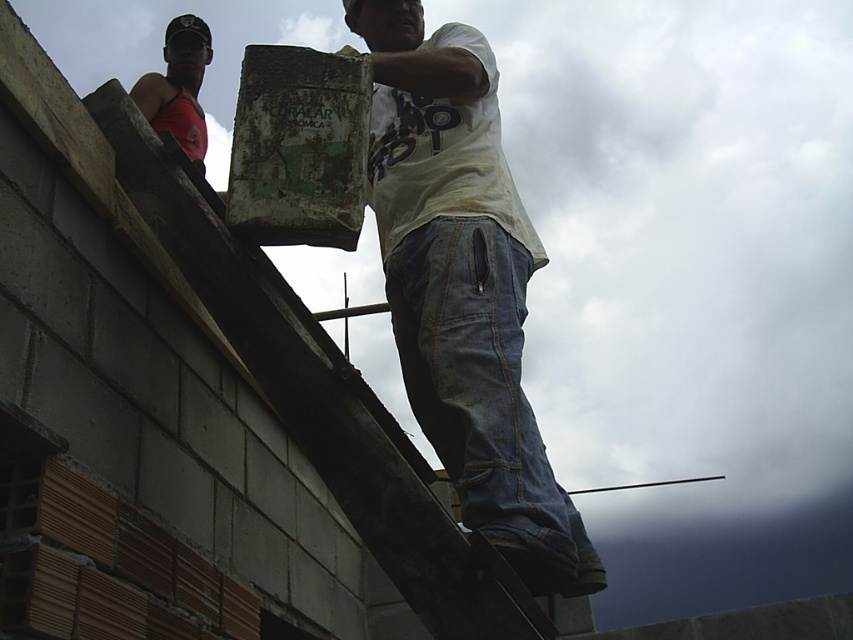
You are an observer looking at the construction site from below. You notice two workers wearing different shirts. The first is a white cotton shirt at center and the second is a matte red tank top at upper left. Which worker is standing higher relative to the other?

The white cotton shirt at center is taller than matte red tank top at upper left, so the worker wearing the white cotton shirt at center is standing higher than the one in the matte red tank top at upper left.

You are a safety inspector observing the construction site from the ground. You notice two workers wearing different colored shirts. The first is wearing a white cotton shirt at center, and the second is wearing a matte red tank top at upper left. According to safety protocols, workers must maintain a minimum distance of 2 meters between each other to prevent accidents. Can you determine if they are following this rule based on their shirt positions?

The white cotton shirt at center is positioned on the right side of matte red tank top at upper left. However, the exact distance between them cannot be determined from the given information about their shirt positions alone.